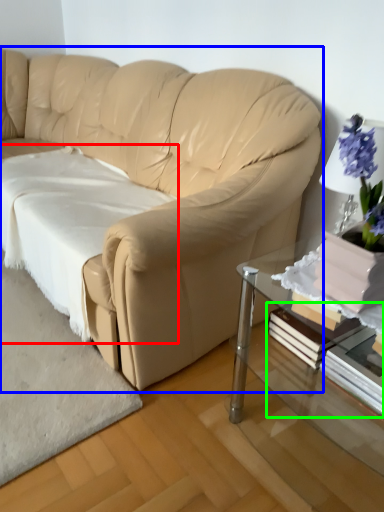
Question: Which is nearer to the sheet (highlighted by a red box)? studio couch (highlighted by a blue box) or book (highlighted by a green box).

Choices:
 (A) studio couch
 (B) book

Answer: (A)